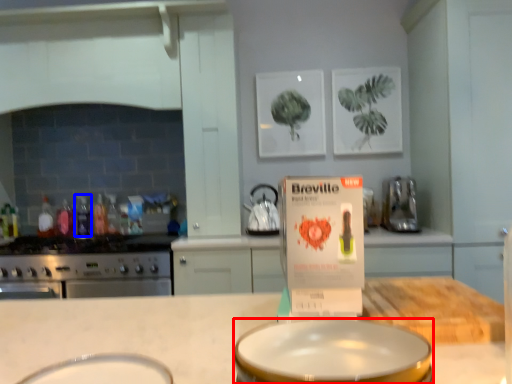
Question: Which point is closer to the camera, basin (highlighted by a red box) or bottle (highlighted by a blue box)?

Choices:
 (A) basin
 (B) bottle

Answer: (A)